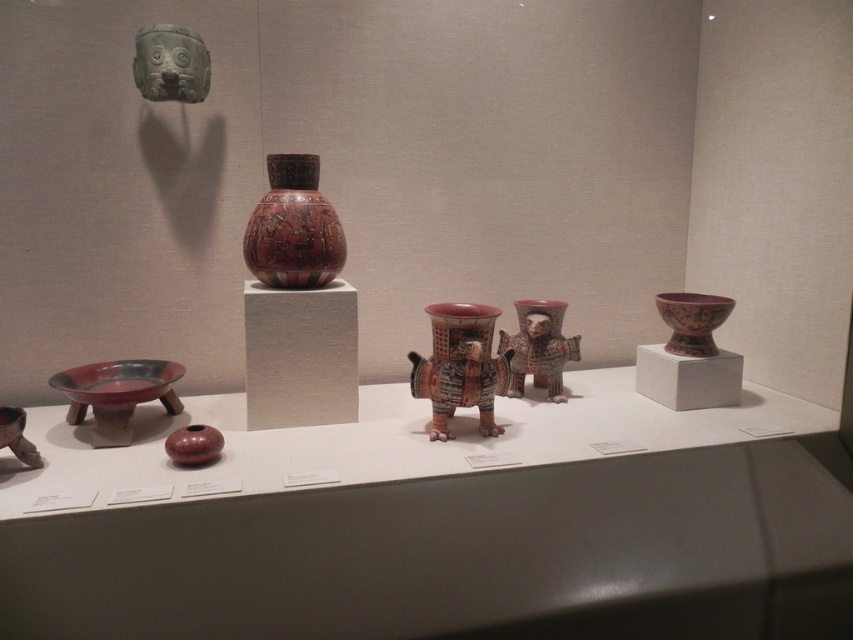
Who is more forward, (463, 390) or (183, 54)?

Point (463, 390)

Does polychrome ceramic vessel at center have a greater height compared to green stone mask at upper left?

Indeed, polychrome ceramic vessel at center has a greater height compared to green stone mask at upper left.

Identify the location of polychrome ceramic vessel at center. (459, 365).

Who is lower down, polychrome ceramic vessel at center or matte red bowl at center right?

polychrome ceramic vessel at center is below.

The image size is (853, 640). Describe the element at coordinates (459, 365) in the screenshot. I see `polychrome ceramic vessel at center` at that location.

This screenshot has height=640, width=853. In order to click on polychrome ceramic vessel at center in this screenshot , I will do `click(459, 365)`.

Between point (720, 426) and point (184, 74), which one is positioned behind?

Positioned behind is point (720, 426).

Does point (419, 401) come farther from viewer compared to point (180, 72)?

Yes.

This screenshot has height=640, width=853. Find the location of `matte ceramic bowl at center`. matte ceramic bowl at center is located at coordinates (379, 444).